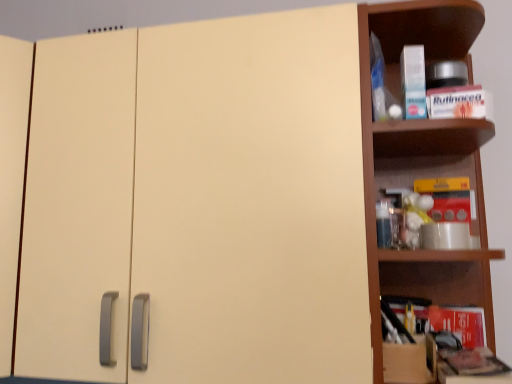
Question: From a real-world perspective, is cardboard box at right physically located above or below matte cream cabinet at center?

Choices:
 (A) above
 (B) below

Answer: (B)

Question: Is cardboard box at right taller or shorter than matte cream cabinet at center?

Choices:
 (A) tall
 (B) short

Answer: (B)

Question: Based on their relative distances, which object is farther from the cardboard box at right?

Choices:
 (A) matte cream cabinet at center
 (B) brown wooden shelf at right

Answer: (A)

Question: Based on their relative distances, which object is farther from the matte cream cabinet at center?

Choices:
 (A) cardboard box at right
 (B) brown wooden shelf at right

Answer: (A)